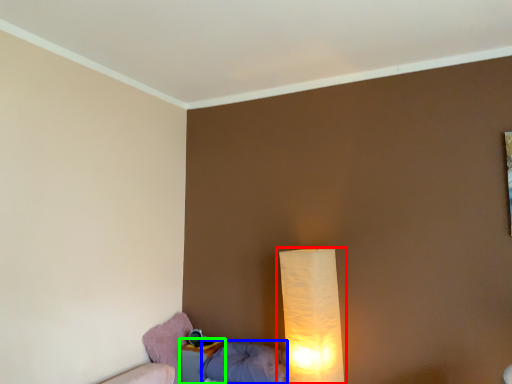
Question: Estimate the real-world distances between objects in this image. Which object is farther from lamp (highlighted by a red box), pillow (highlighted by a blue box) or nightstand (highlighted by a green box)?

Choices:
 (A) pillow
 (B) nightstand

Answer: (B)